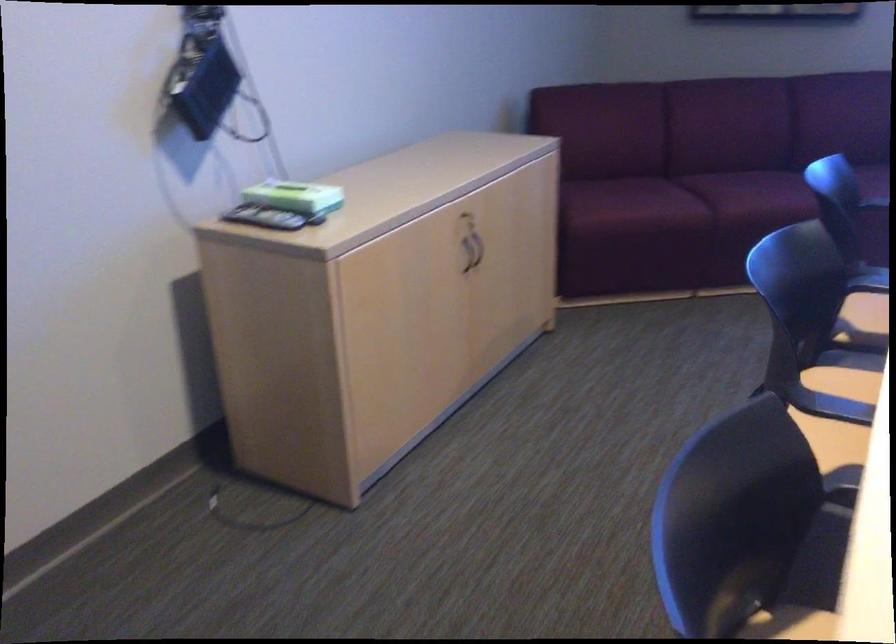
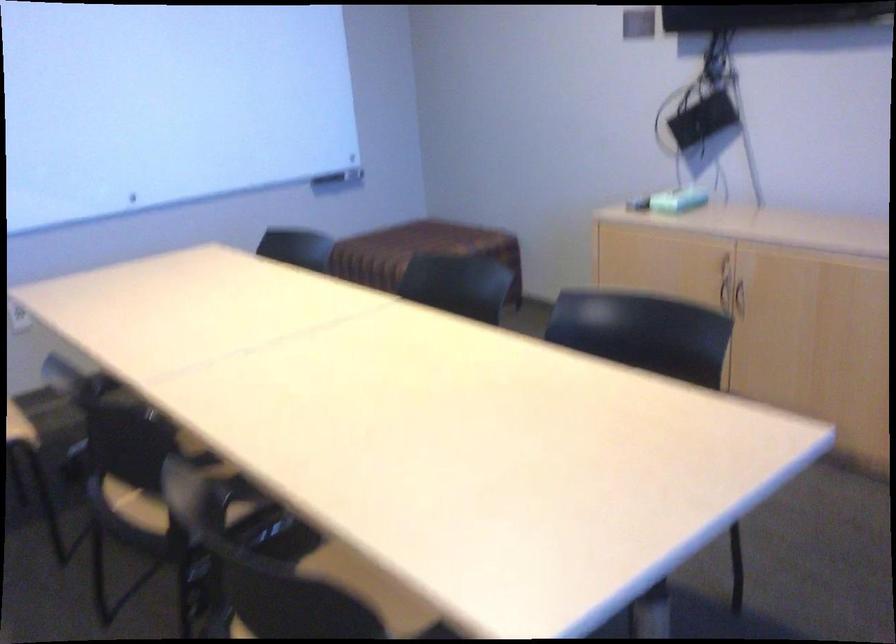
Find the pixel in the second image that matches point 451,269 in the first image.

(725, 295)